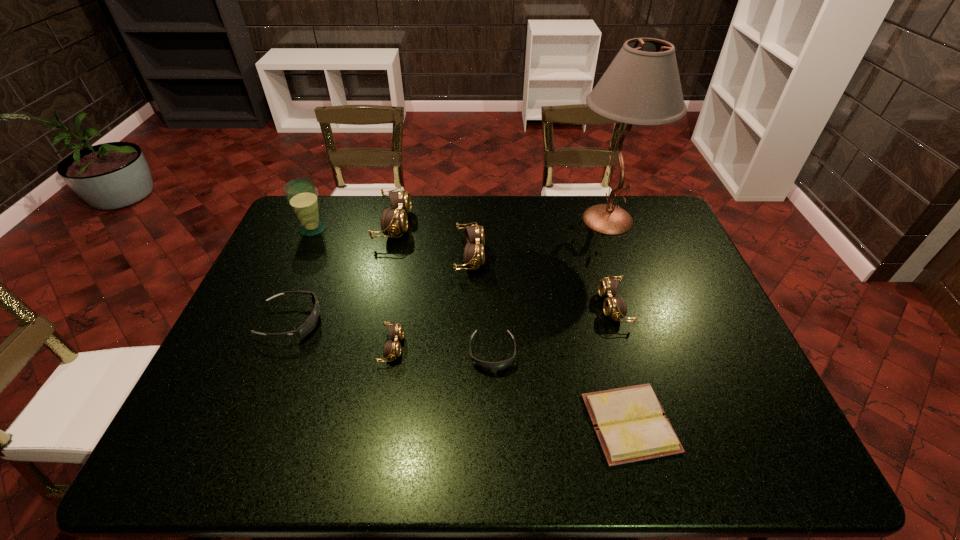
Where is `glass at the far edge`? The width and height of the screenshot is (960, 540). glass at the far edge is located at coordinates (302, 196).

The height and width of the screenshot is (540, 960). In order to click on object that is at the near edge in this screenshot , I will do `click(630, 423)`.

Locate an element on the screen. Image resolution: width=960 pixels, height=540 pixels. glass that is at the left edge is located at coordinates (302, 196).

Locate an element on the screen. The height and width of the screenshot is (540, 960). goggles present at the left edge is located at coordinates (310, 323).

What are the coordinates of `object present at the right edge` in the screenshot? It's located at (642, 86).

The image size is (960, 540). What are the coordinates of `object present at the far left corner` in the screenshot? It's located at (302, 196).

At what (x,y) coordinates should I click in order to perform the action: click on object present at the far right corner. Please return your answer as a coordinate pair (x, y). Looking at the image, I should click on (642, 86).

This screenshot has width=960, height=540. I want to click on vacant space at the far edge of the desktop, so click(471, 212).

Find the location of a particular element. The image size is (960, 540). free space at the left edge is located at coordinates (211, 376).

In the image, there is a desktop. What are the coordinates of `vacant space at the right edge` in the screenshot? It's located at (686, 288).